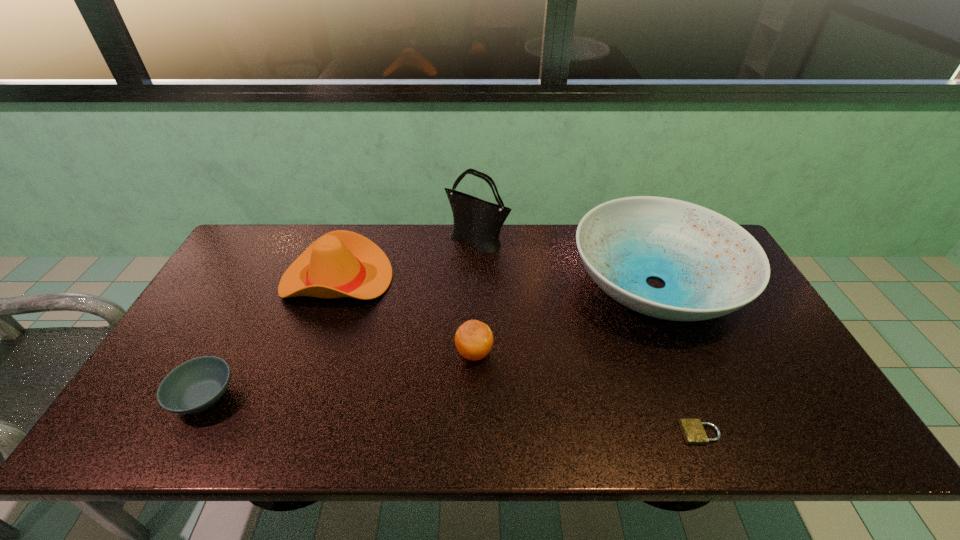
Image resolution: width=960 pixels, height=540 pixels. I want to click on vacant space that is in between the padlock and the tallest object, so click(588, 337).

Identify the location of free space between the cowboy hat and the dish. The width and height of the screenshot is (960, 540). [496, 281].

What are the coordinates of `vacant area between the cowboy hat and the tallest object` in the screenshot? It's located at (407, 260).

I want to click on vacant space that is in between the padlock and the dish, so click(x=678, y=359).

Where is `vacant area between the soup bowl and the cowboy hat`? This screenshot has width=960, height=540. vacant area between the soup bowl and the cowboy hat is located at coordinates (271, 338).

The height and width of the screenshot is (540, 960). I want to click on empty location between the orange and the tallest object, so click(x=476, y=297).

Identify the location of free space between the second shortest object and the third shortest object. This screenshot has width=960, height=540. [339, 375].

Identify the location of free space between the cowboy hat and the tallest object. Image resolution: width=960 pixels, height=540 pixels. [x=407, y=260].

Where is `object that is the fourth closest to the third shortest object`? The height and width of the screenshot is (540, 960). object that is the fourth closest to the third shortest object is located at coordinates (693, 431).

I want to click on object that can be found as the closest to the dish, so click(x=479, y=222).